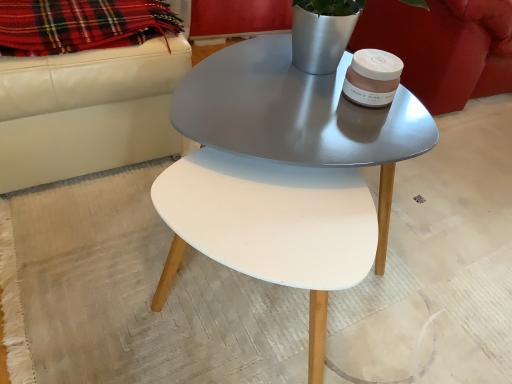
At what (x,y) coordinates should I click in order to perform the action: click on blank space situated above metallic gray coffee table at center (from a real-world perspective). Please return your answer as a coordinate pair (x, y). Looking at the image, I should click on (290, 102).